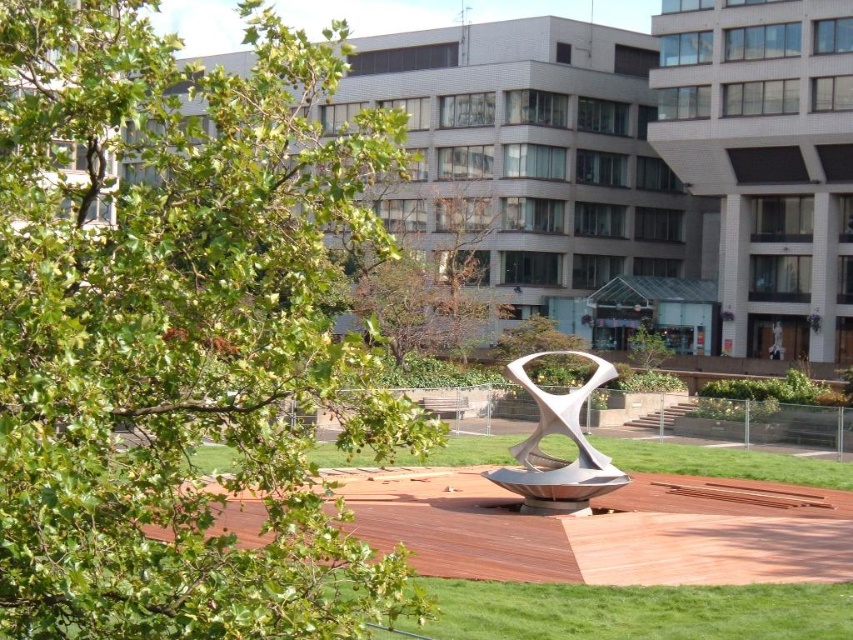
Question: Can you confirm if brown leafy tree at center is wider than green grass at center?

Choices:
 (A) no
 (B) yes

Answer: (A)

Question: Which point appears closest to the camera in this image?

Choices:
 (A) (387, 307)
 (B) (502, 481)
 (C) (279, 314)

Answer: (C)

Question: Which is farther from the green grass at lower center?

Choices:
 (A) brown leafy tree at center
 (B) green grass at center

Answer: (A)

Question: Which of the following is the farthest from the observer?

Choices:
 (A) green grass at center
 (B) brown leafy tree at center
 (C) green leafy tree at upper left
 (D) satin silver sculpture at center

Answer: (D)

Question: Is green leafy tree at upper left thinner than green grass at center?

Choices:
 (A) no
 (B) yes

Answer: (B)

Question: Does green leafy tree at upper left lie in front of green grass at lower center?

Choices:
 (A) yes
 (B) no

Answer: (A)